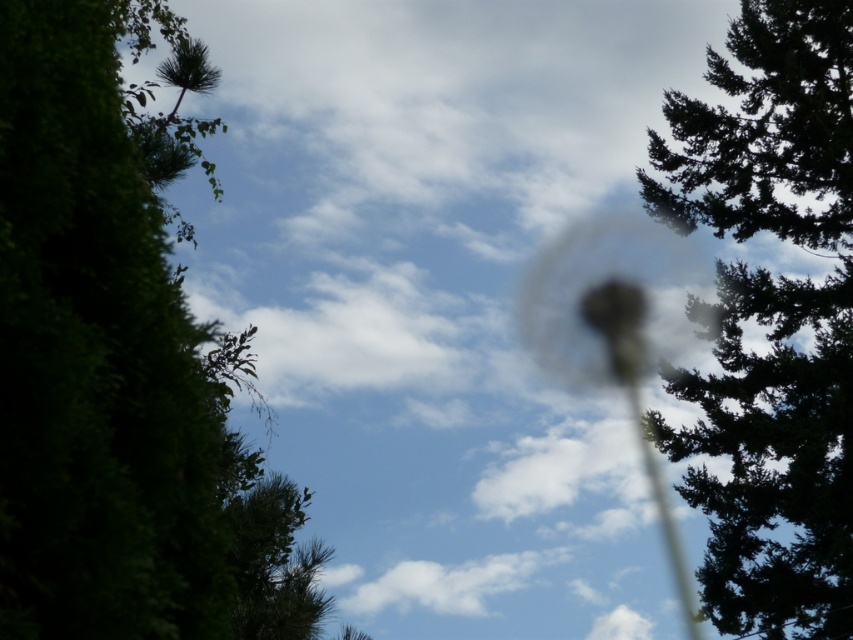
Question: Which of the following is the closest to the observer?

Choices:
 (A) green leafy tree at left
 (B) green textured tree at upper right

Answer: (A)

Question: Is green leafy tree at left below green textured tree at upper right?

Choices:
 (A) no
 (B) yes

Answer: (A)

Question: Does green leafy tree at left have a larger size compared to green textured tree at upper right?

Choices:
 (A) yes
 (B) no

Answer: (B)

Question: Can you confirm if green leafy tree at left is positioned to the left of green textured tree at upper right?

Choices:
 (A) no
 (B) yes

Answer: (B)

Question: Which object is closer to the camera taking this photo?

Choices:
 (A) green textured tree at upper right
 (B) green leafy tree at left

Answer: (B)